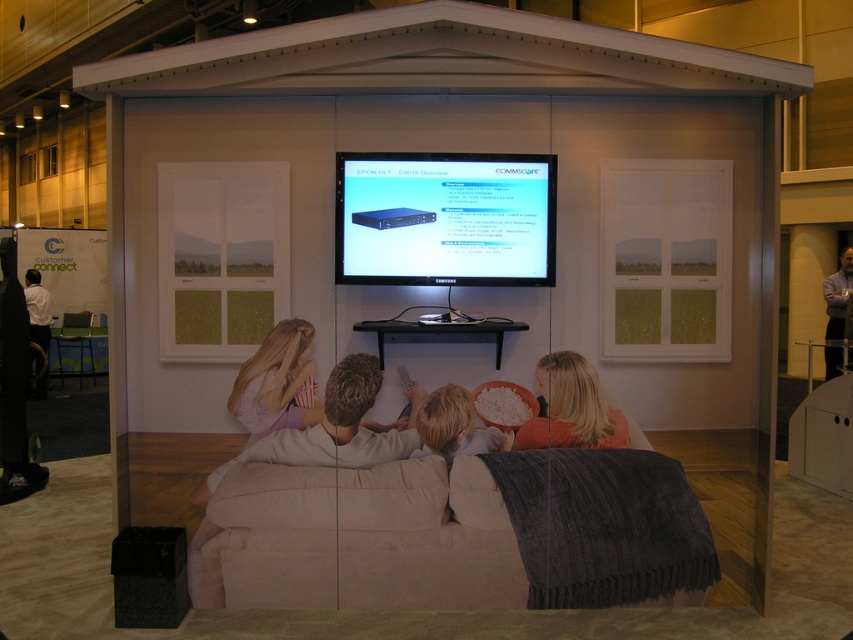
Is light brown fabric couch at center shorter than pastel purple fabric at center?

Incorrect, light brown fabric couch at center's height does not fall short of pastel purple fabric at center's.

Image resolution: width=853 pixels, height=640 pixels. Find the location of `light brown fabric couch at center`. light brown fabric couch at center is located at coordinates (335, 428).

Where is `light brown fabric couch at center`? Image resolution: width=853 pixels, height=640 pixels. light brown fabric couch at center is located at coordinates (335, 428).

Is matte black monitor at center closer to the viewer compared to pastel purple fabric at center?

Yes.

What do you see at coordinates (444, 218) in the screenshot?
I see `matte black monitor at center` at bounding box center [444, 218].

The image size is (853, 640). Identify the location of matte black monitor at center. (444, 218).

Does light brown fabric couch at center have a smaller size compared to orange fleece blanket at lower center?

No.

Is point (360, 438) less distant than point (576, 436)?

Yes, it is in front of point (576, 436).

Find the location of a particular element. The width and height of the screenshot is (853, 640). light brown fabric couch at center is located at coordinates (335, 428).